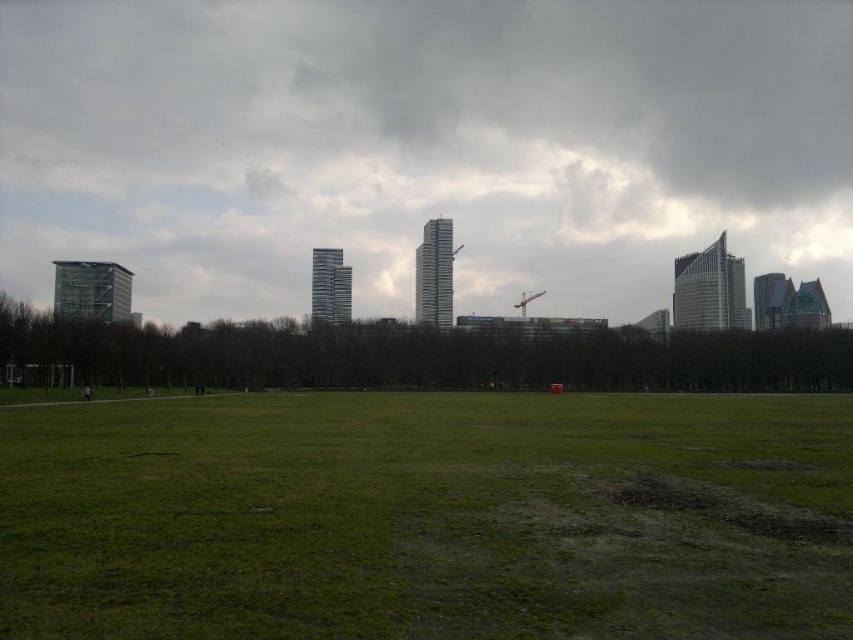
You are planning to fly a kite in the grassy field shown in the image. You notice the white fluffy cloud at upper center and the green grass at center. Which object is wider according to the description?

The white fluffy cloud at upper center might be wider than green grass at center according to the description.

In the scene shown: You are a drone operator who needs to fly a drone from the white fluffy cloud at upper center to the green grass at center. Given that the drone can only travel in a straight line and has a maximum range of 1000 feet, will it be able to reach the destination without recharging?

The white fluffy cloud at upper center and green grass at center are 1032.42 feet apart from each other. Since the drone has a maximum range of 1000 feet, it will not be able to reach the green grass at center without recharging.